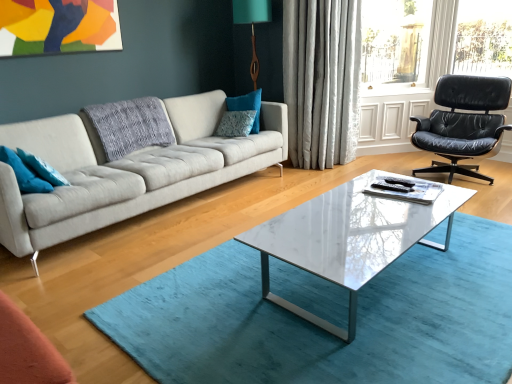
Locate an element on the screen. The width and height of the screenshot is (512, 384). teal fabric pillow at center, positioned as the fourth pillow in front-to-back order is located at coordinates 247,106.

The image size is (512, 384). What do you see at coordinates (247, 106) in the screenshot?
I see `teal fabric pillow at center, placed as the fourth pillow when sorted from left to right` at bounding box center [247, 106].

How much space does teal fabric pillow at left, acting as the second pillow starting from the front, occupy horizontally?

teal fabric pillow at left, acting as the second pillow starting from the front, is 21.82 centimeters in width.

The height and width of the screenshot is (384, 512). In order to click on light gray fabric couch at center in this screenshot , I will do `click(127, 170)`.

What do you see at coordinates (322, 80) in the screenshot? The height and width of the screenshot is (384, 512). I see `silky gray curtain at upper right` at bounding box center [322, 80].

What do you see at coordinates (349, 238) in the screenshot?
I see `white marble coffee table at center` at bounding box center [349, 238].

Find the location of a particular element. The height and width of the screenshot is (384, 512). teal fabric pillow at left, positioned as the first pillow in left-to-right order is located at coordinates (24, 173).

Identify the location of curtain above the light gray fabric couch at center (from the image's perspective). (322, 80).

Considering the sizes of objects silky gray curtain at upper right and light gray fabric couch at center in the image provided, who is thinner, silky gray curtain at upper right or light gray fabric couch at center?

silky gray curtain at upper right.

Is silky gray curtain at upper right facing away from light gray fabric couch at center?

No, silky gray curtain at upper right is not facing the opposite direction of light gray fabric couch at center.

Considering the relative positions of light gray fabric couch at center and black leather chair at right in the image provided, is light gray fabric couch at center in front of black leather chair at right?

Yes, the depth of light gray fabric couch at center is less than that of black leather chair at right.

This screenshot has width=512, height=384. Identify the location of chair above the light gray fabric couch at center (from a real-world perspective). (463, 123).

From a real-world perspective, is light gray fabric couch at center positioned under black leather chair at right based on gravity?

Yes, from a real-world perspective, light gray fabric couch at center is under black leather chair at right.

Looking at the image, does light gray fabric couch at center seem bigger or smaller compared to black leather chair at right?

→ In the image, light gray fabric couch at center appears to be larger than black leather chair at right.

Does light gray fabric couch at center have a lesser height compared to white marble coffee table at center?

No.

Is light gray fabric couch at center bigger or smaller than white marble coffee table at center?

In the image, light gray fabric couch at center appears to be larger than white marble coffee table at center.

From the picture: From the image's perspective, which one is positioned higher, light gray fabric couch at center or white marble coffee table at center?

From the image's view, light gray fabric couch at center is above.

Are light gray fabric couch at center and white marble coffee table at center beside each other?

light gray fabric couch at center and white marble coffee table at center are clearly separated.

Between point (238, 115) and point (305, 103), which one is positioned behind?

The point (305, 103) is behind.

Is blue textured pillow at center, which is counted as the second pillow, starting from the back, facing away from silky gray curtain at upper right?

No.

Between blue textured pillow at center, the 3th pillow when ordered from left to right, and silky gray curtain at upper right, which one appears on the right side from the viewer's perspective?

From the viewer's perspective, silky gray curtain at upper right appears more on the right side.

Is blue textured pillow at center, placed as the second pillow when sorted from right to left, positioned behind silky gray curtain at upper right?

Yes, blue textured pillow at center, placed as the second pillow when sorted from right to left, is further from the viewer.

From a real-world perspective, who is located higher, teal fabric pillow at left, the fourth pillow when ordered from right to left, or white marble coffee table at center?

teal fabric pillow at left, the fourth pillow when ordered from right to left, from a real-world perspective.

Is teal fabric pillow at left, which appears as the first pillow when viewed from the front, oriented towards white marble coffee table at center?

No, teal fabric pillow at left, which appears as the first pillow when viewed from the front, does not turn towards white marble coffee table at center.

Who is smaller, teal fabric pillow at left, which is counted as the fourth pillow, starting from the back, or white marble coffee table at center?

With smaller size is teal fabric pillow at left, which is counted as the fourth pillow, starting from the back.

Is silky gray curtain at upper right surrounded by teal fabric pillow at left, acting as the second pillow starting from the front?

No, silky gray curtain at upper right is not inside teal fabric pillow at left, acting as the second pillow starting from the front.

How distant is teal fabric pillow at left, acting as the second pillow starting from the front, from silky gray curtain at upper right?

A distance of 2.40 meters exists between teal fabric pillow at left, acting as the second pillow starting from the front, and silky gray curtain at upper right.

From the image's perspective, which one is positioned lower, teal fabric pillow at left, placed as the third pillow when sorted from right to left, or silky gray curtain at upper right?

From the image's view, teal fabric pillow at left, placed as the third pillow when sorted from right to left, is below.

Which is closer, (42, 175) or (320, 9)?

Positioned in front is point (42, 175).

Is point (55, 182) positioned after point (292, 223)?

Yes, it is.

Considering the relative sizes of teal fabric pillow at left, placed as the third pillow when sorted from right to left, and white marble coffee table at center in the image provided, is teal fabric pillow at left, placed as the third pillow when sorted from right to left, taller than white marble coffee table at center?

No, teal fabric pillow at left, placed as the third pillow when sorted from right to left, is not taller than white marble coffee table at center.

Is teal fabric pillow at left, acting as the second pillow starting from the front, at the left side of white marble coffee table at center?

Indeed, teal fabric pillow at left, acting as the second pillow starting from the front, is positioned on the left side of white marble coffee table at center.

You are a GUI agent. You are given a task and a screenshot of the screen. Output one action in this format:
    pyautogui.click(x=<x>, y=<y>)
    Task: Click on the curtain lying on the right of light gray fabric couch at center
    This screenshot has height=384, width=512.
    Given the screenshot: What is the action you would take?
    pyautogui.click(x=322, y=80)

The height and width of the screenshot is (384, 512). What are the coordinates of `chair behind the light gray fabric couch at center` in the screenshot? It's located at (463, 123).

Considering their positions, is teal fabric pillow at center, the 1th pillow in the right-to-left sequence, positioned further to light gray fabric couch at center than teal fabric pillow at left, acting as the second pillow starting from the front?

teal fabric pillow at center, the 1th pillow in the right-to-left sequence, is positioned further to the anchor light gray fabric couch at center.

Which object lies nearer to the anchor point black leather chair at right, white marble coffee table at center or teal fabric pillow at left, which is counted as the fourth pillow, starting from the back?

The object closer to black leather chair at right is white marble coffee table at center.

Considering their positions, is teal fabric pillow at left, positioned as the 2th pillow in left-to-right order, positioned further to blue textured pillow at center, the 3th pillow when ordered from left to right, than white marble coffee table at center?

Among the two, white marble coffee table at center is located further to blue textured pillow at center, the 3th pillow when ordered from left to right.

From the image, which object appears to be farther from teal fabric pillow at left, placed as the third pillow when sorted from right to left, teal fabric pillow at left, the fourth pillow when ordered from right to left, or white marble coffee table at center?

white marble coffee table at center is further to teal fabric pillow at left, placed as the third pillow when sorted from right to left.

Based on the photo, when comparing their distances from black leather chair at right, does teal fabric pillow at center, placed as the fourth pillow when sorted from left to right, or teal fabric pillow at left, which is counted as the third pillow, starting from the back, seem further?

teal fabric pillow at left, which is counted as the third pillow, starting from the back, is further to black leather chair at right.

Estimate the real-world distances between objects in this image. Which object is further from silky gray curtain at upper right, white marble coffee table at center or teal fabric pillow at left, the fourth pillow when ordered from right to left?

Based on the image, teal fabric pillow at left, the fourth pillow when ordered from right to left, appears to be further to silky gray curtain at upper right.

When comparing their distances from teal fabric pillow at left, which is counted as the third pillow, starting from the back, does teal fabric pillow at center, placed as the fourth pillow when sorted from left to right, or white marble coffee table at center seem further?

Among the two, teal fabric pillow at center, placed as the fourth pillow when sorted from left to right, is located further to teal fabric pillow at left, which is counted as the third pillow, starting from the back.

From the image, which object appears to be farther from black leather chair at right, white marble coffee table at center or blue textured pillow at center, which is counted as the second pillow, starting from the back?

blue textured pillow at center, which is counted as the second pillow, starting from the back, is further to black leather chair at right.

The width and height of the screenshot is (512, 384). Identify the location of chair between white marble coffee table at center and teal fabric pillow at center, the first pillow when ordered from back to front, in the front-back direction. (463, 123).

This screenshot has height=384, width=512. Identify the location of curtain between white marble coffee table at center and transparent glass window screen at upper right from front to back. (322, 80).

This screenshot has height=384, width=512. I want to click on studio couch between teal fabric pillow at left, acting as the second pillow starting from the front, and black leather chair at right, so [127, 170].

This screenshot has width=512, height=384. Identify the location of curtain between light gray fabric couch at center and transparent glass window screen at upper right in the horizontal direction. (322, 80).